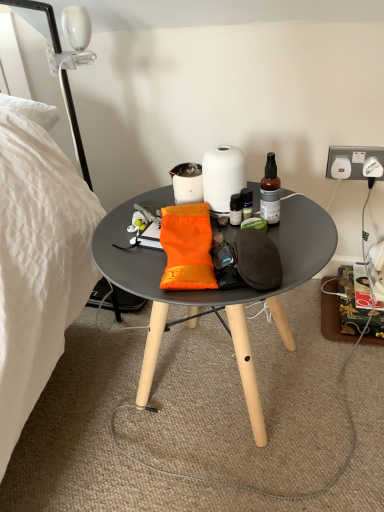
The height and width of the screenshot is (512, 384). Find the location of `vacant region in front of translucent glass bottle at upper right`. vacant region in front of translucent glass bottle at upper right is located at coordinates (291, 252).